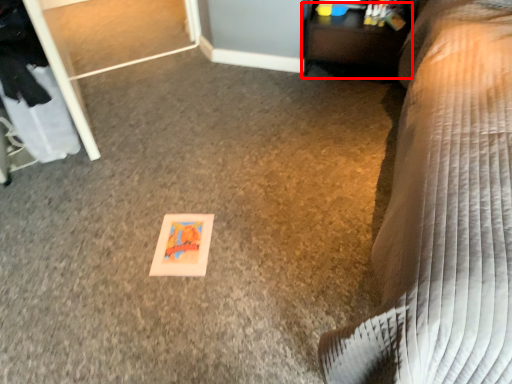
Question: Considering the relative positions of table (annotated by the red box) and furniture in the image provided, where is table (annotated by the red box) located with respect to the staircase?

Choices:
 (A) right
 (B) left

Answer: (B)